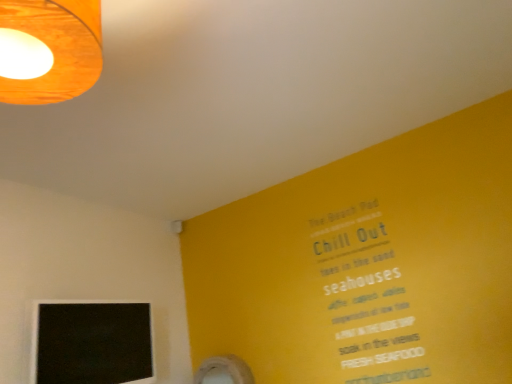
Question: Do you think wooden lampshade at upper left is within black matte computer monitor at lower left, or outside of it?

Choices:
 (A) outside
 (B) inside

Answer: (A)

Question: Considering the positions of wooden lampshade at upper left and black matte computer monitor at lower left in the image, is wooden lampshade at upper left wider or thinner than black matte computer monitor at lower left?

Choices:
 (A) wide
 (B) thin

Answer: (A)

Question: Visually, is wooden lampshade at upper left positioned to the left or to the right of black matte computer monitor at lower left?

Choices:
 (A) right
 (B) left

Answer: (A)

Question: In terms of size, does black matte computer monitor at lower left appear bigger or smaller than wooden lampshade at upper left?

Choices:
 (A) small
 (B) big

Answer: (B)

Question: Is black matte computer monitor at lower left wider or thinner than wooden lampshade at upper left?

Choices:
 (A) thin
 (B) wide

Answer: (A)

Question: Is black matte computer monitor at lower left taller or shorter than wooden lampshade at upper left?

Choices:
 (A) short
 (B) tall

Answer: (B)

Question: In the image, is black matte computer monitor at lower left positioned in front of or behind wooden lampshade at upper left?

Choices:
 (A) behind
 (B) front

Answer: (A)